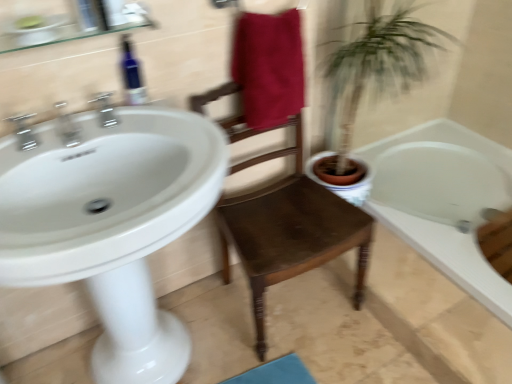
Question: Would you say white glossy sink at left is outside blue glass bottle at upper left?

Choices:
 (A) yes
 (B) no

Answer: (A)

Question: Is blue glass bottle at upper left located within white glossy sink at left?

Choices:
 (A) no
 (B) yes

Answer: (A)

Question: From a real-world perspective, is white glossy sink at left located higher than blue glass bottle at upper left?

Choices:
 (A) yes
 (B) no

Answer: (B)

Question: Is white glossy sink at left directly adjacent to blue glass bottle at upper left?

Choices:
 (A) no
 (B) yes

Answer: (A)

Question: Is white glossy sink at left further to the viewer compared to blue glass bottle at upper left?

Choices:
 (A) yes
 (B) no

Answer: (B)

Question: In terms of size, does silver metallic faucet at upper left, acting as the third tap starting from the left, appear bigger or smaller than brown wooden chair at center?

Choices:
 (A) small
 (B) big

Answer: (A)

Question: Considering the positions of point (104, 94) and point (251, 256), is point (104, 94) closer or farther from the camera than point (251, 256)?

Choices:
 (A) closer
 (B) farther

Answer: (A)

Question: From the image's perspective, is silver metallic faucet at upper left, acting as the third tap starting from the left, positioned above or below brown wooden chair at center?

Choices:
 (A) above
 (B) below

Answer: (A)

Question: Do you think silver metallic faucet at upper left, acting as the third tap starting from the left, is within brown wooden chair at center, or outside of it?

Choices:
 (A) inside
 (B) outside

Answer: (B)

Question: Looking at the image, does white glossy sink at left seem bigger or smaller compared to maroon fabric towel at center?

Choices:
 (A) small
 (B) big

Answer: (B)

Question: From a real-world perspective, is white glossy sink at left physically located above or below maroon fabric towel at center?

Choices:
 (A) above
 (B) below

Answer: (B)

Question: Based on their positions, is white glossy sink at left located to the left or right of maroon fabric towel at center?

Choices:
 (A) right
 (B) left

Answer: (B)

Question: Is white glossy sink at left taller or shorter than maroon fabric towel at center?

Choices:
 (A) short
 (B) tall

Answer: (B)

Question: Is point (266, 89) positioned closer to the camera than point (13, 122)?

Choices:
 (A) farther
 (B) closer

Answer: (A)

Question: From the image's perspective, is maroon fabric towel at center positioned above or below chrome metallic faucet at upper left, positioned as the first tap in left-to-right order?

Choices:
 (A) below
 (B) above

Answer: (B)